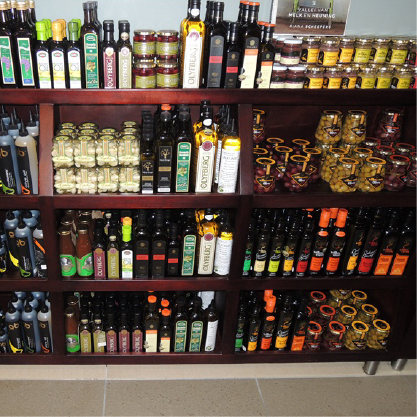
This screenshot has width=417, height=417. What are the coordinates of `cherry wood shelves` in the screenshot? It's located at coord(45,101).